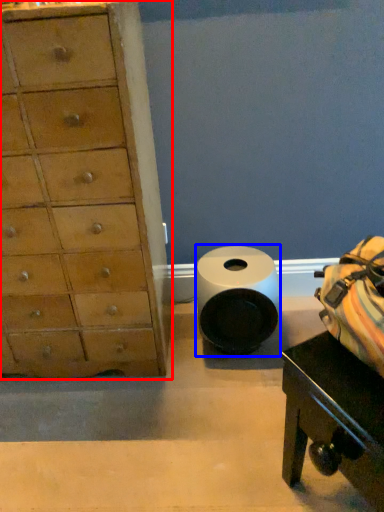
Question: Which of the following is the closest to the observer, chest of drawers (highlighted by a red box) or toilet paper (highlighted by a blue box)?

Choices:
 (A) chest of drawers
 (B) toilet paper

Answer: (A)